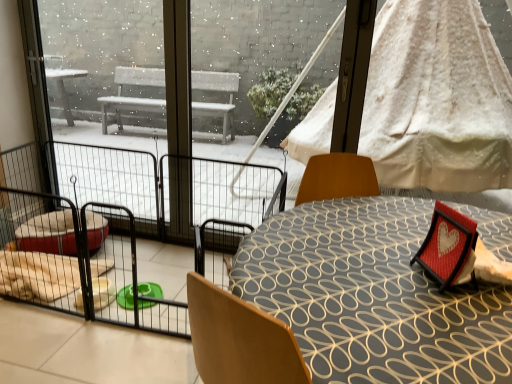
Question: Considering the relative sizes of transparent glass door at upper left and red fabric heart frame at lower right in the image provided, is transparent glass door at upper left wider than red fabric heart frame at lower right?

Choices:
 (A) yes
 (B) no

Answer: (B)

Question: Does transparent glass door at upper left come in front of red fabric heart frame at lower right?

Choices:
 (A) yes
 (B) no

Answer: (B)

Question: From the image's perspective, is transparent glass door at upper left located above red fabric heart frame at lower right?

Choices:
 (A) yes
 (B) no

Answer: (A)

Question: Is transparent glass door at upper left turned away from red fabric heart frame at lower right?

Choices:
 (A) yes
 (B) no

Answer: (B)

Question: Can you confirm if transparent glass door at upper left is shorter than red fabric heart frame at lower right?

Choices:
 (A) yes
 (B) no

Answer: (B)

Question: From a real-world perspective, is transparent glass door at upper left over red fabric heart frame at lower right?

Choices:
 (A) no
 (B) yes

Answer: (A)

Question: Can you confirm if black wire mesh at left is bigger than transparent glass door at upper left?

Choices:
 (A) yes
 (B) no

Answer: (B)

Question: From the image's perspective, is black wire mesh at left on top of transparent glass door at upper left?

Choices:
 (A) no
 (B) yes

Answer: (B)

Question: Is black wire mesh at left oriented away from transparent glass door at upper left?

Choices:
 (A) yes
 (B) no

Answer: (A)

Question: Does black wire mesh at left have a greater height compared to transparent glass door at upper left?

Choices:
 (A) yes
 (B) no

Answer: (B)

Question: Can transparent glass door at upper left be found inside black wire mesh at left?

Choices:
 (A) yes
 (B) no

Answer: (B)

Question: From a real-world perspective, does black wire mesh at left stand above transparent glass door at upper left?

Choices:
 (A) yes
 (B) no

Answer: (B)

Question: Does red fabric heart frame at lower right have a smaller size compared to white textured fabric canopy bed at upper right?

Choices:
 (A) no
 (B) yes

Answer: (B)